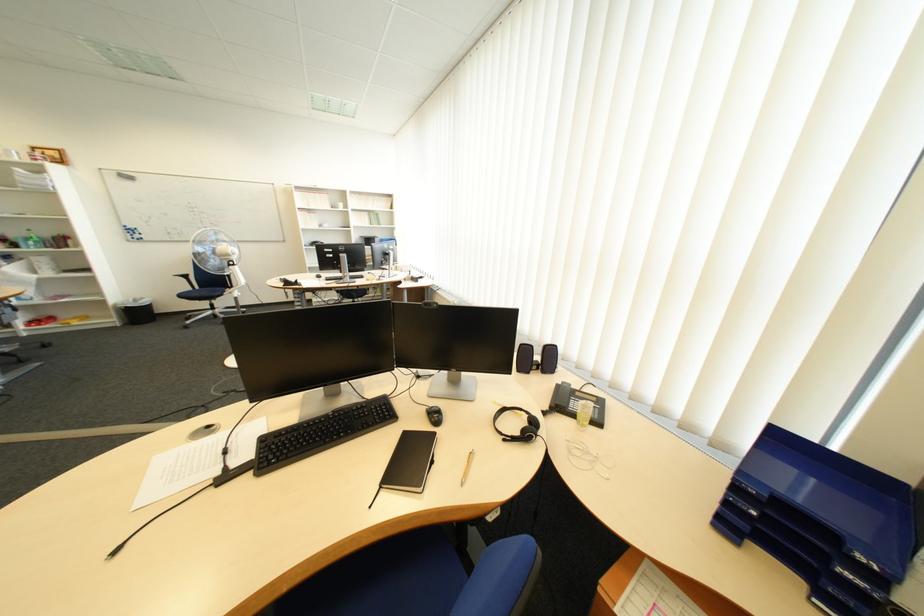
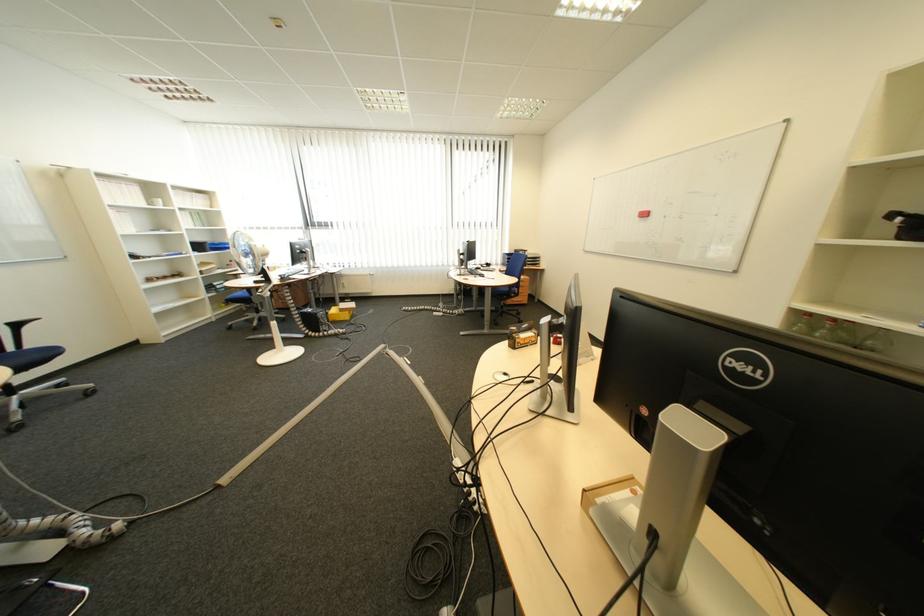
Question: I am providing you with two images of the same scene from different viewpoints. After the viewpoint changes to image2, which objects are now occluded?

Choices:
 (A) black chair armrest
 (B) blue binder
 (C) small clear bottle
 (D) white shampoo bottle

Answer: (C)